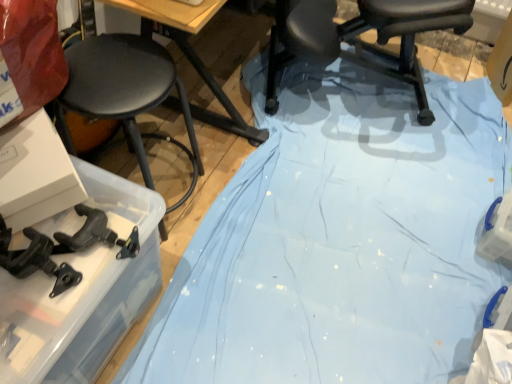
Find the location of `wooden at upper center`. wooden at upper center is located at coordinates (172, 12).

Describe the element at coordinates (172, 12) in the screenshot. This screenshot has height=384, width=512. I see `wooden at upper center` at that location.

The height and width of the screenshot is (384, 512). I want to click on black plastic chair at center, so click(359, 40).

What do you see at coordinates (359, 40) in the screenshot? I see `black plastic chair at center` at bounding box center [359, 40].

Measure the distance between point (113, 55) and camera.

A distance of 3.47 feet exists between point (113, 55) and camera.

The height and width of the screenshot is (384, 512). I want to click on wooden at upper center, so click(x=172, y=12).

Which object is wider, black plastic chair at center or wooden at upper center?

black plastic chair at center is wider.

Can you confirm if black plastic chair at center is taller than wooden at upper center?

Yes, black plastic chair at center is taller than wooden at upper center.

From a real-world perspective, is black plastic chair at center located beneath wooden at upper center?

Yes.

From a real-world perspective, between wooden at upper center and black matte stool at left, who is vertically lower?

From a 3D spatial view, black matte stool at left is below.

Is wooden at upper center facing away from black matte stool at left?

That's not correct — wooden at upper center is not looking away from black matte stool at left.

Between wooden at upper center and black matte stool at left, which one has larger size?

black matte stool at left is bigger.

Considering the relative positions of black matte stool at left and black plastic chair at center in the image provided, is black matte stool at left to the left of black plastic chair at center from the viewer's perspective?

Correct, you'll find black matte stool at left to the left of black plastic chair at center.

How much distance is there between black matte stool at left and black plastic chair at center?

black matte stool at left and black plastic chair at center are 25.22 inches apart from each other.

This screenshot has width=512, height=384. I want to click on chair on the right of black matte stool at left, so click(359, 40).

From the image's perspective, is black matte stool at left located beneath black plastic chair at center?

Yes, from the image's perspective, black matte stool at left is below black plastic chair at center.

Is black plastic chair at center facing towards black matte stool at left?

No, black plastic chair at center does not turn towards black matte stool at left.

Is black plastic chair at center completely or partially outside of black matte stool at left?

black plastic chair at center lies outside black matte stool at left's area.

Looking at this image, from the image's perspective, between black plastic chair at center and black matte stool at left, who is located below?

black matte stool at left, from the image's perspective.

Does point (100, 44) appear closer or farther from the camera than point (214, 1)?

Clearly, point (100, 44) is more distant from the camera than point (214, 1).

At what (x,y) coordinates should I click in order to perform the action: click on stool located underneath the wooden at upper center (from a real-world perspective). Please return your answer as a coordinate pair (x, y). This screenshot has height=384, width=512. Looking at the image, I should click on (124, 92).

Considering the sizes of objects black matte stool at left and wooden at upper center in the image provided, who is thinner, black matte stool at left or wooden at upper center?

wooden at upper center is thinner.

Is wooden at upper center in front of or behind black plastic chair at center in the image?

In the image, wooden at upper center appears in front of black plastic chair at center.

How far apart are wooden at upper center and black plastic chair at center?

They are 63.53 centimeters apart.

From the picture: Does wooden at upper center turn towards black plastic chair at center?

No, wooden at upper center is not oriented towards black plastic chair at center.

From the image's perspective, who appears lower, wooden at upper center or black plastic chair at center?

wooden at upper center appears lower in the image.

Find the location of a particular element. This screenshot has height=384, width=512. chair directly beneath the wooden at upper center (from a real-world perspective) is located at coordinates (359, 40).

Identify the location of stool in front of the wooden at upper center. (124, 92).

From the image, which object appears to be nearer to black matte stool at left, wooden at upper center or black plastic chair at center?

Based on the image, wooden at upper center appears to be nearer to black matte stool at left.

When comparing their distances from wooden at upper center, does black plastic chair at center or black matte stool at left seem closer?

black matte stool at left is closer to wooden at upper center.

Based on their spatial positions, is black matte stool at left or black plastic chair at center closer to wooden at upper center?

Based on the image, black matte stool at left appears to be nearer to wooden at upper center.

Estimate the real-world distances between objects in this image. Which object is further from black plastic chair at center, black matte stool at left or wooden at upper center?

black matte stool at left is further to black plastic chair at center.

From the image, which object appears to be farther from black matte stool at left, black plastic chair at center or wooden at upper center?

black plastic chair at center lies further to black matte stool at left than the other object.

From the image, which object appears to be nearer to black plastic chair at center, wooden at upper center or black matte stool at left?

wooden at upper center lies closer to black plastic chair at center than the other object.

I want to click on table top between black matte stool at left and black plastic chair at center, so click(x=172, y=12).